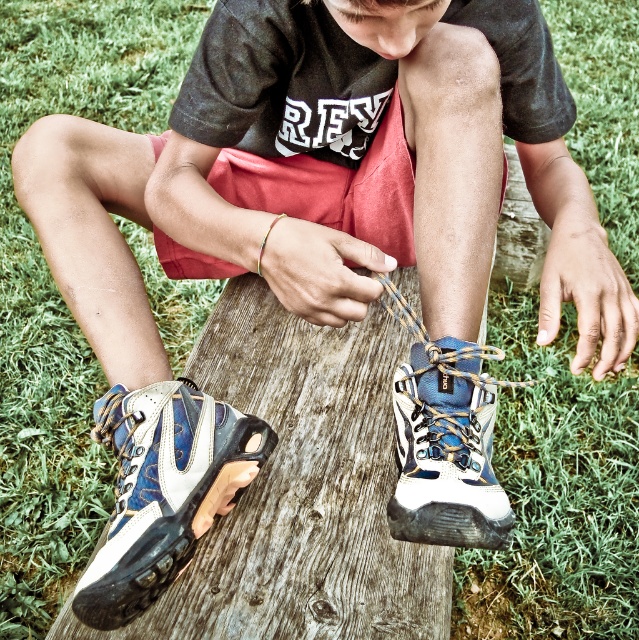
Question: Which of the following is the farthest from the observer?

Choices:
 (A) white leather sneaker at lower center
 (B) blue suede hiking boot at center

Answer: (B)

Question: Is white leather sneaker at lower center closer to the viewer compared to blue suede hiking boot at center?

Choices:
 (A) no
 (B) yes

Answer: (B)

Question: Is white leather sneaker at lower center below blue suede hiking boot at center?

Choices:
 (A) yes
 (B) no

Answer: (A)

Question: Does white leather sneaker at lower center appear on the right side of blue suede hiking boot at center?

Choices:
 (A) no
 (B) yes

Answer: (A)

Question: Among these objects, which one is farthest from the camera?

Choices:
 (A) blue suede hiking boot at center
 (B) white leather sneaker at lower center

Answer: (A)